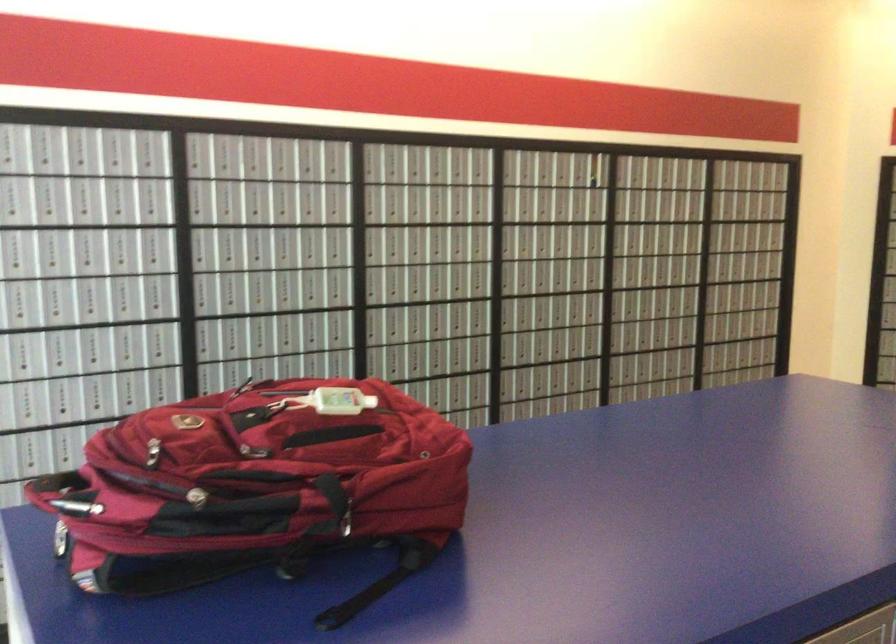
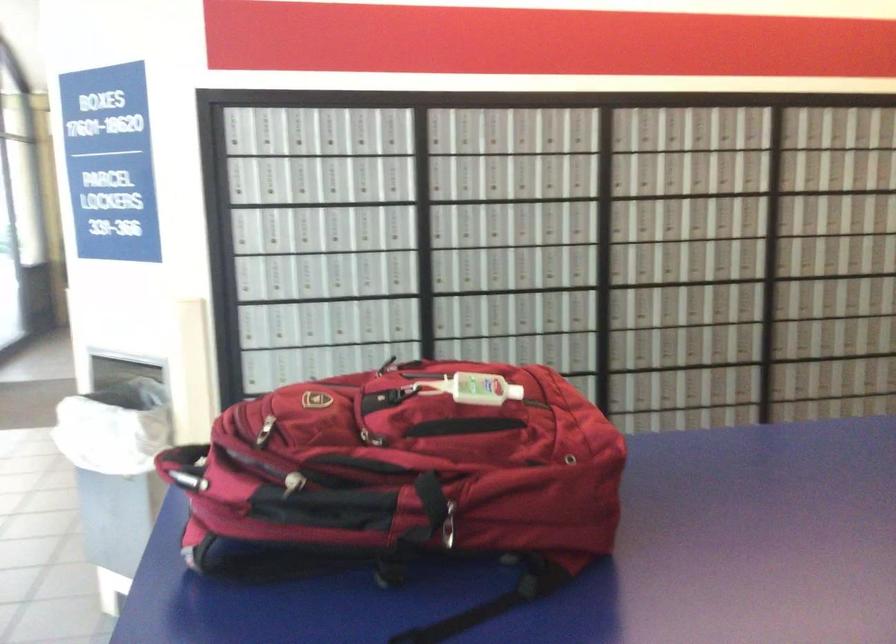
Find the pixel in the second image that matches (339,399) in the first image.

(471, 389)